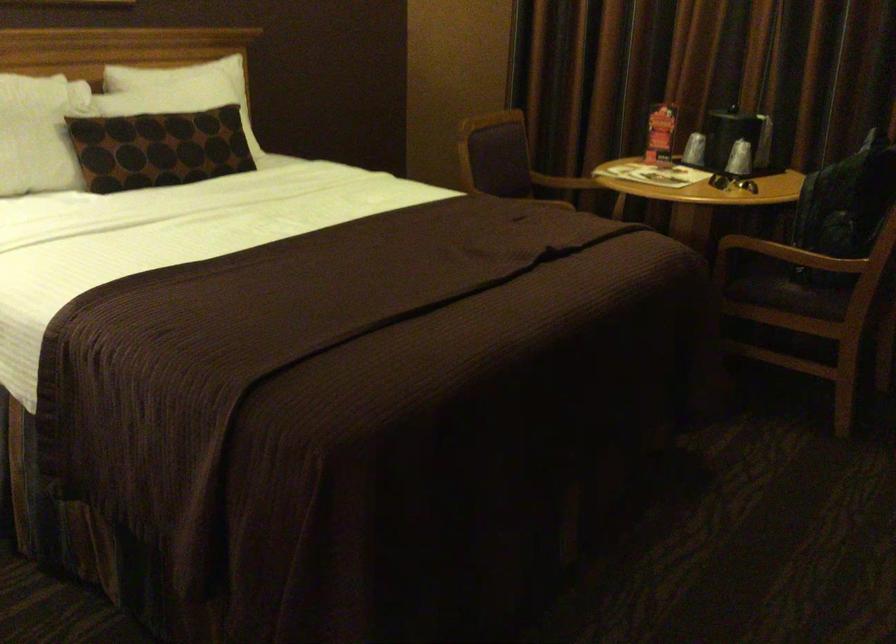
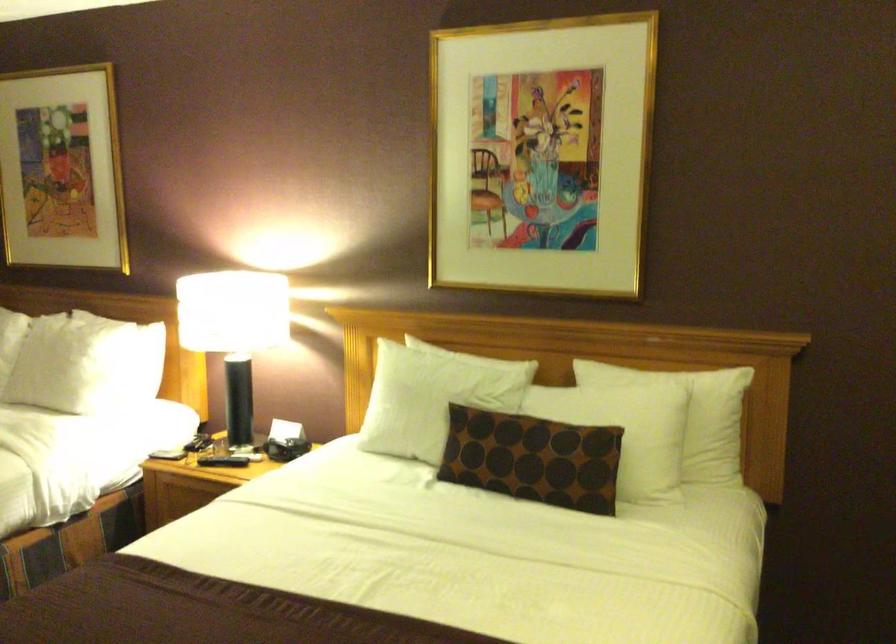
Locate, in the second image, the point that corresponds to point 247,95 in the first image.

(709, 422)